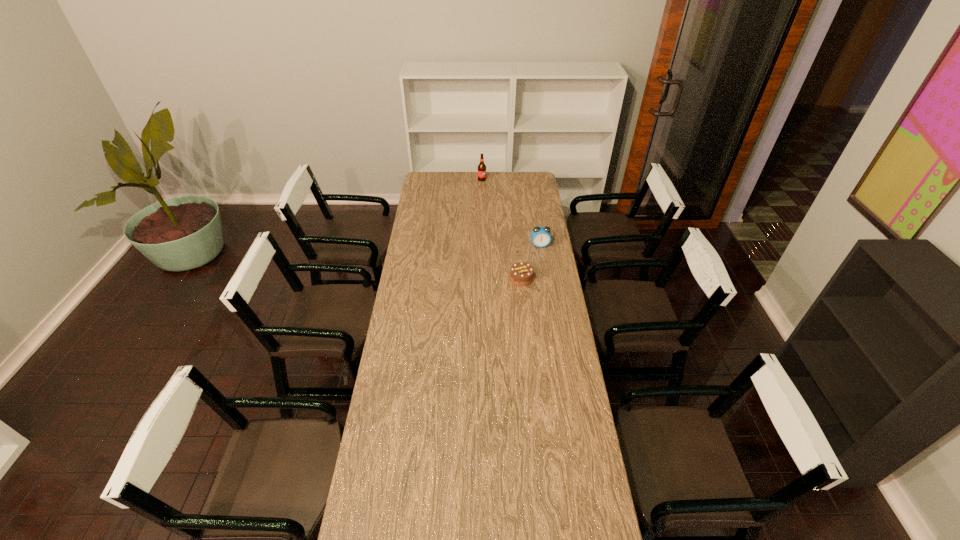
What are the coordinates of `alarm clock that is at the right edge` in the screenshot? It's located at (540, 236).

Locate an element on the screen. This screenshot has width=960, height=540. chocolate cake that is at the right edge is located at coordinates (521, 273).

I want to click on vacant space at the far edge of the desktop, so click(x=468, y=172).

Image resolution: width=960 pixels, height=540 pixels. I want to click on free space at the left edge of the desktop, so click(422, 193).

The height and width of the screenshot is (540, 960). What are the coordinates of `vacant space at the right edge of the desktop` in the screenshot? It's located at (562, 521).

In the image, there is a desktop. At what (x,y) coordinates should I click in order to perform the action: click on vacant space at the far right corner. Please return your answer as a coordinate pair (x, y). This screenshot has height=540, width=960. Looking at the image, I should click on (515, 180).

The height and width of the screenshot is (540, 960). I want to click on vacant space that is in between the shortest object and the second tallest object, so click(x=531, y=262).

Identify which object is located as the nearest to the second nearest object. Please provide its 2D coordinates. Your answer should be formatted as a tuple, i.e. [(x, y)], where the tuple contains the x and y coordinates of a point satisfying the conditions above.

[(521, 273)]

Select which object is the second closest to the farthest object. Please provide its 2D coordinates. Your answer should be formatted as a tuple, i.e. [(x, y)], where the tuple contains the x and y coordinates of a point satisfying the conditions above.

[(521, 273)]

You are a GUI agent. You are given a task and a screenshot of the screen. Output one action in this format:
    pyautogui.click(x=<x>, y=<y>)
    Task: Click on the vacant area that satisfies the following two spatial constraints: 1. on the front side of the tallest object; 2. on the left side of the shortest object
    The height and width of the screenshot is (540, 960).
    Given the screenshot: What is the action you would take?
    483,278